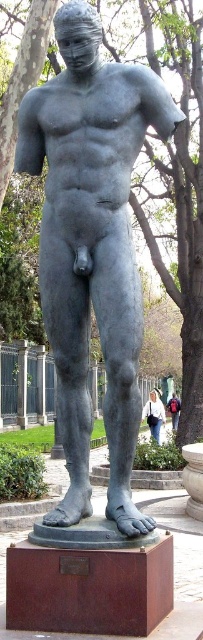
You are an art curator arranging an exhibition. You have a matte gray statue at center and a white cotton shirt at lower center. Which object should be placed closer to the entrance to ensure visitors can easily view both items without obstruction?

The matte gray statue at center might be wider than the white cotton shirt at lower center, so placing the statue closer to the entrance would allow visitors to see both items without the shirt being blocked by the statue.

You are an art student who wants to place a red backpack at center next to a matte gray statue at center. Given that the statue is wider than the backpack, which object would require more horizontal space when placing them side by side?

The matte gray statue at center requires more horizontal space because its width is larger than the red backpack at center.

You are an art curator planning to display both the matte gray statue at center and the red backpack at center in a gallery. Based on their sizes, which object should be placed on a higher platform to ensure they appear balanced in the exhibition layout?

The matte gray statue at center is taller than the red backpack at center, so to balance their heights in the exhibition layout, the red backpack at center should be placed on a higher platform than the matte gray statue at center.